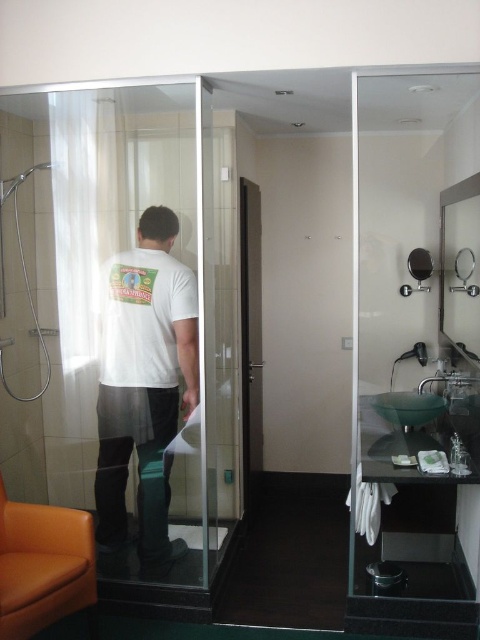
From the picture: You are trying to see your reflection in the matte black mirror at upper right while standing inside the transparent glass door at center. Will the glass door block your view of the mirror?

The transparent glass door at center is in front of the matte black mirror at upper right, so the glass door will block your view of the mirror.